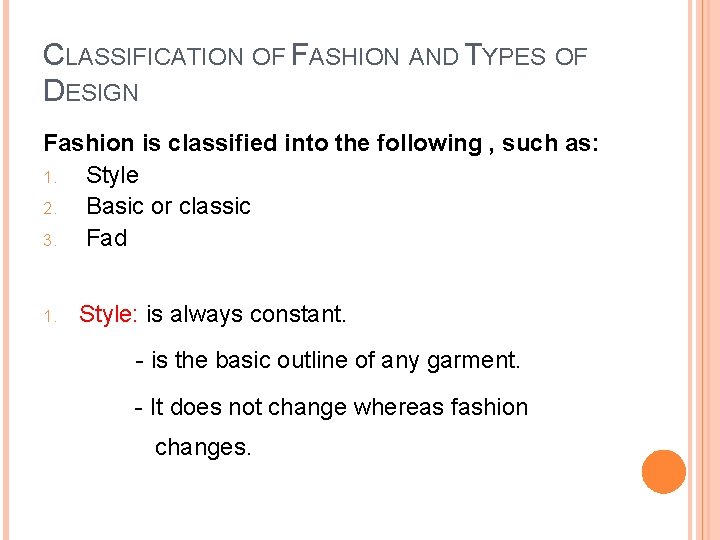
Where is `frame`? The height and width of the screenshot is (540, 720). frame is located at coordinates (3, 185), (714, 234).